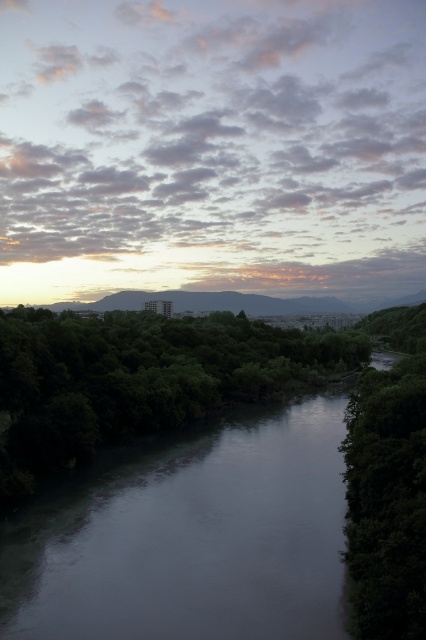
Question: Which point is farther from the camera taking this photo?

Choices:
 (A) (66, 333)
 (B) (377, 632)

Answer: (A)

Question: Does smooth gray river at center come behind green leafy tree at right?

Choices:
 (A) no
 (B) yes

Answer: (B)

Question: Can you confirm if green leafy trees at lower left is positioned below green leafy tree at right?

Choices:
 (A) no
 (B) yes

Answer: (A)

Question: Can you confirm if green leafy trees at lower left is thinner than green leafy tree at right?

Choices:
 (A) no
 (B) yes

Answer: (A)

Question: Which is farther from the green leafy tree at right?

Choices:
 (A) smooth gray river at center
 (B) green leafy trees at lower left

Answer: (B)

Question: Among these objects, which one is nearest to the camera?

Choices:
 (A) green leafy tree at right
 (B) green leafy trees at lower left
 (C) smooth gray river at center

Answer: (A)